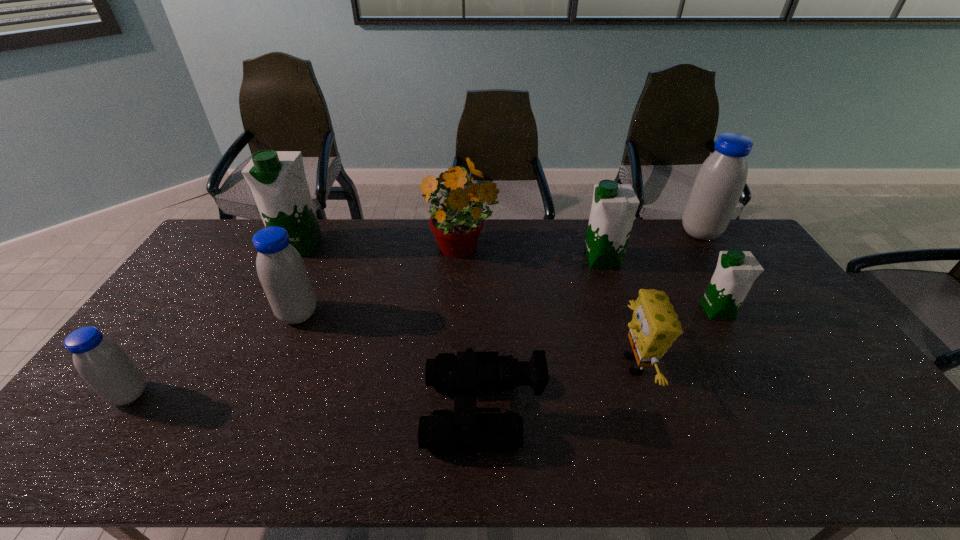
Locate an element on the screen. This screenshot has width=960, height=540. free area in between the second green soya milk from right to left and the sponge is located at coordinates (618, 312).

The width and height of the screenshot is (960, 540). What are the coordinates of `unoccupied area between the biggest green soya milk and the shortest object` in the screenshot? It's located at 392,328.

The width and height of the screenshot is (960, 540). Identify the location of vacant area that lies between the rightmost green soya milk and the shortest object. (600, 361).

Find the location of a particular element. empty space between the leftmost soya milk and the leftmost green soya milk is located at coordinates (215, 320).

In order to click on free spot between the leftmost green soya milk and the rightmost blue soya milk in this screenshot , I will do (x=500, y=239).

Where is `unoccupied position between the biggest blue soya milk and the shortest object`? unoccupied position between the biggest blue soya milk and the shortest object is located at coordinates (591, 321).

At what (x,y) coordinates should I click in order to perform the action: click on unoccupied area between the biggest blue soya milk and the shortest object. Please return your answer as a coordinate pair (x, y). The image size is (960, 540). Looking at the image, I should click on (591, 321).

The width and height of the screenshot is (960, 540). I want to click on blank region between the biggest blue soya milk and the second biggest blue soya milk, so click(499, 273).

Find the location of a particular element. Image resolution: width=960 pixels, height=540 pixels. object that is the eighth closest to the binoculars is located at coordinates (719, 183).

Locate an element on the screen. The image size is (960, 540). object that stands as the fifth closest to the nearest green soya milk is located at coordinates (456, 226).